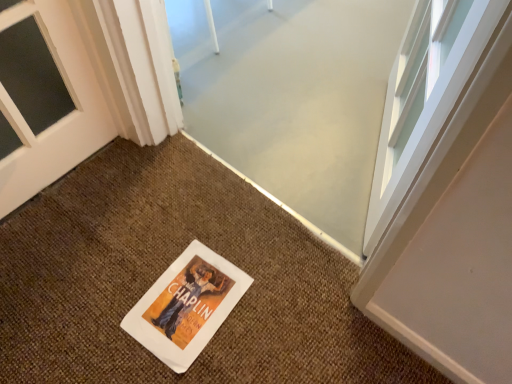
Where is `free location to the right of white paper flyer at center`? The width and height of the screenshot is (512, 384). free location to the right of white paper flyer at center is located at coordinates (279, 302).